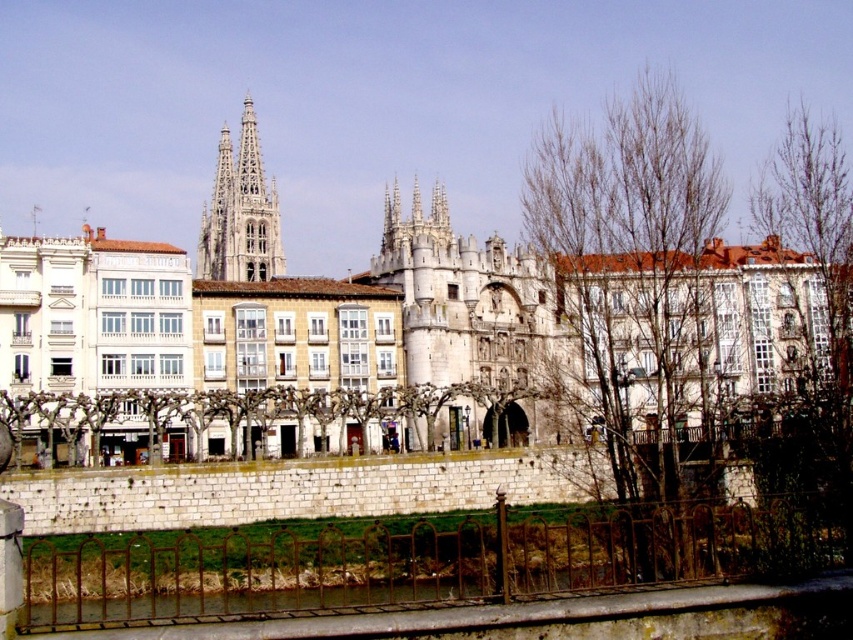
Question: Considering the real-world distances, which object is farthest from the smooth stone spire at center?

Choices:
 (A) bare branches at center
 (B) white stone gate at center
 (C) bare branches at right
 (D) white stone tower at upper left

Answer: (C)

Question: Is bare branches at right wider than smooth stone spire at center?

Choices:
 (A) yes
 (B) no

Answer: (A)

Question: Which object is positioned farthest from the white stone gate at center?

Choices:
 (A) white stone tower at upper left
 (B) bare branches at right
 (C) bare branches at center
 (D) smooth stone spire at center

Answer: (D)

Question: Which is nearer to the smooth stone spire at center?

Choices:
 (A) bare branches at center
 (B) bare branches at right

Answer: (A)

Question: Is white stone gate at center positioned before bare branches at center?

Choices:
 (A) yes
 (B) no

Answer: (B)

Question: Is bare branches at right above white stone tower at upper left?

Choices:
 (A) yes
 (B) no

Answer: (B)